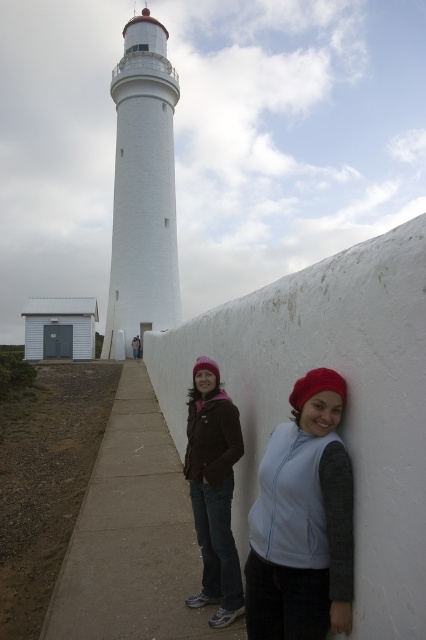
Question: Does white painted concrete lighthouse at left appear on the left side of matte brown jacket at center?

Choices:
 (A) yes
 (B) no

Answer: (A)

Question: Which point is farther to the camera?

Choices:
 (A) (192, 461)
 (B) (140, 285)

Answer: (B)

Question: Which of the following is the farthest from the observer?

Choices:
 (A) matte brown jacket at center
 (B) white painted concrete lighthouse at left
 (C) light blue fleece vest at center

Answer: (B)

Question: Is white painted concrete lighthouse at left in front of matte brown jacket at center?

Choices:
 (A) no
 (B) yes

Answer: (A)

Question: Which object is the farthest from the matte brown jacket at center?

Choices:
 (A) light blue fleece vest at center
 (B) white painted concrete lighthouse at left

Answer: (B)

Question: Does white painted concrete lighthouse at left have a greater width compared to matte brown jacket at center?

Choices:
 (A) no
 (B) yes

Answer: (B)